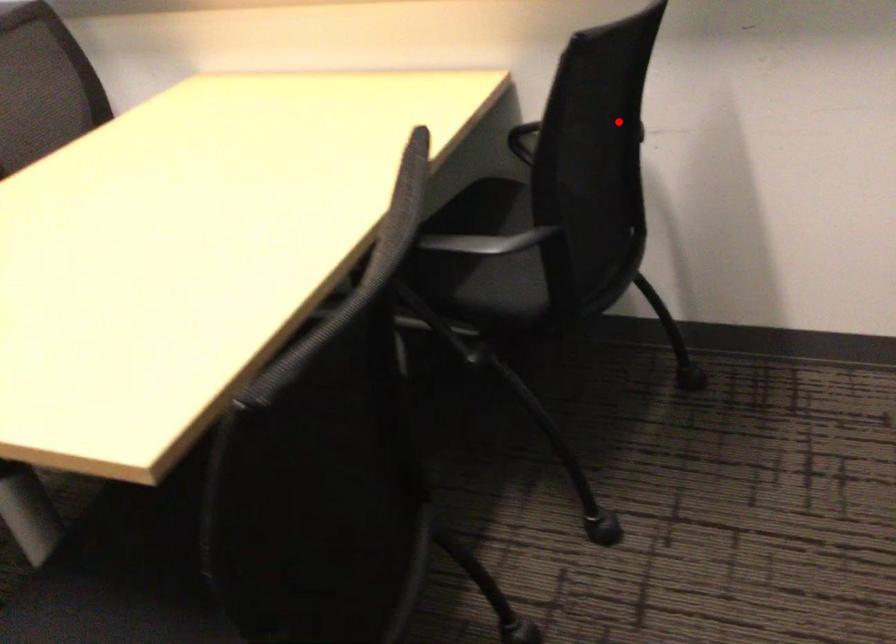
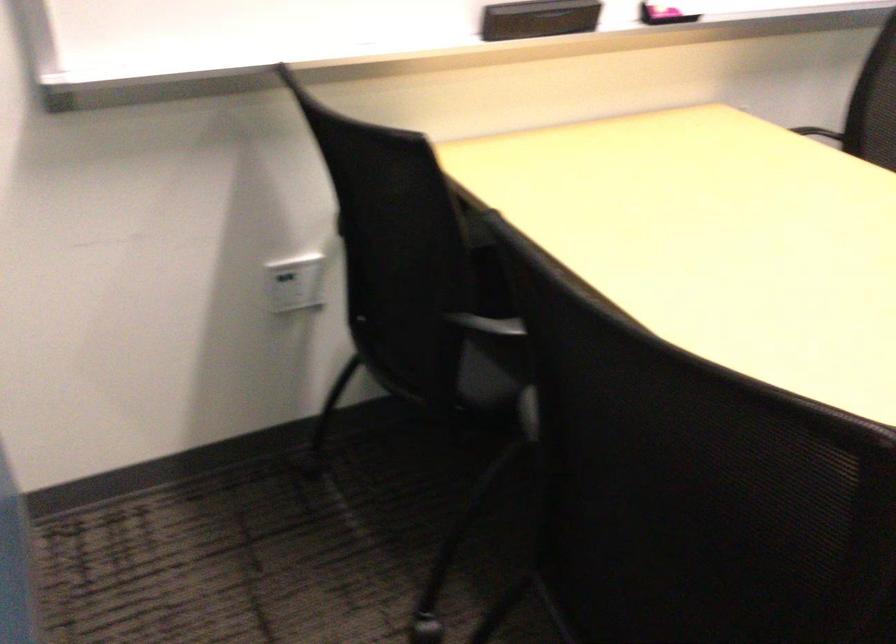
Locate, in the second image, the point that corresponds to the highlighted location in the first image.

(817, 131)